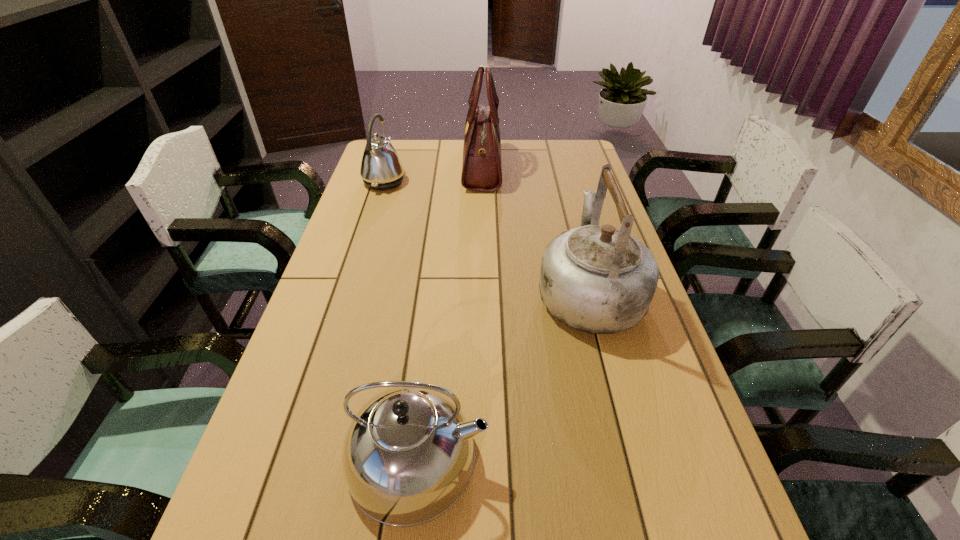
The height and width of the screenshot is (540, 960). I want to click on vacant space that's between the second nearest object and the nearest object, so click(x=503, y=374).

This screenshot has height=540, width=960. I want to click on vacant area that lies between the nearest object and the tallest kettle, so click(503, 374).

Locate an element on the screen. object that ranks as the third closest to the nearest object is located at coordinates (481, 171).

Identify which object is the third nearest to the second nearest kettle. Please provide its 2D coordinates. Your answer should be formatted as a tuple, i.e. [(x, y)], where the tuple contains the x and y coordinates of a point satisfying the conditions above.

[(381, 168)]

Identify which kettle is located as the nearest to the nearest kettle. Please provide its 2D coordinates. Your answer should be formatted as a tuple, i.e. [(x, y)], where the tuple contains the x and y coordinates of a point satisfying the conditions above.

[(599, 279)]

Identify which kettle is the closest to the second farthest kettle. Please provide its 2D coordinates. Your answer should be formatted as a tuple, i.e. [(x, y)], where the tuple contains the x and y coordinates of a point satisfying the conditions above.

[(408, 456)]

Where is `vacant point that satisfies the following two spatial constraints: 1. on the front-facing side of the handbag; 2. at the spout of the third farthest object`? vacant point that satisfies the following two spatial constraints: 1. on the front-facing side of the handbag; 2. at the spout of the third farthest object is located at coordinates (483, 292).

The height and width of the screenshot is (540, 960). Find the location of `vacant space that satisfies the following two spatial constraints: 1. at the spout of the second farthest kettle; 2. on the front-facing side of the handbag`. vacant space that satisfies the following two spatial constraints: 1. at the spout of the second farthest kettle; 2. on the front-facing side of the handbag is located at coordinates (556, 167).

In order to click on free location that satisfies the following two spatial constraints: 1. on the front-facing side of the handbag; 2. at the spout of the tallest kettle in this screenshot , I will do `click(483, 292)`.

The width and height of the screenshot is (960, 540). Find the location of `free space that satisfies the following two spatial constraints: 1. on the front-facing side of the handbag; 2. at the spout of the second nearest object`. free space that satisfies the following two spatial constraints: 1. on the front-facing side of the handbag; 2. at the spout of the second nearest object is located at coordinates (483, 292).